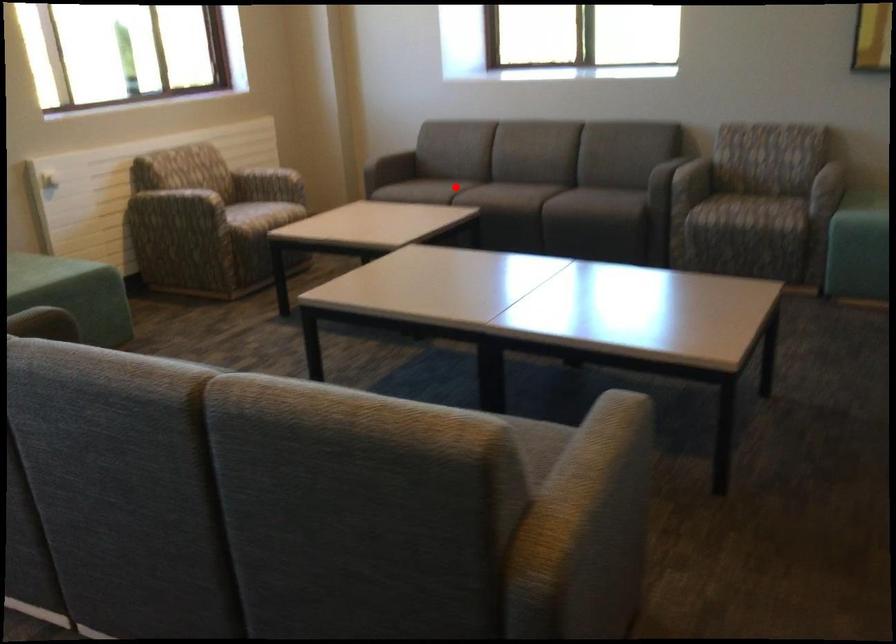
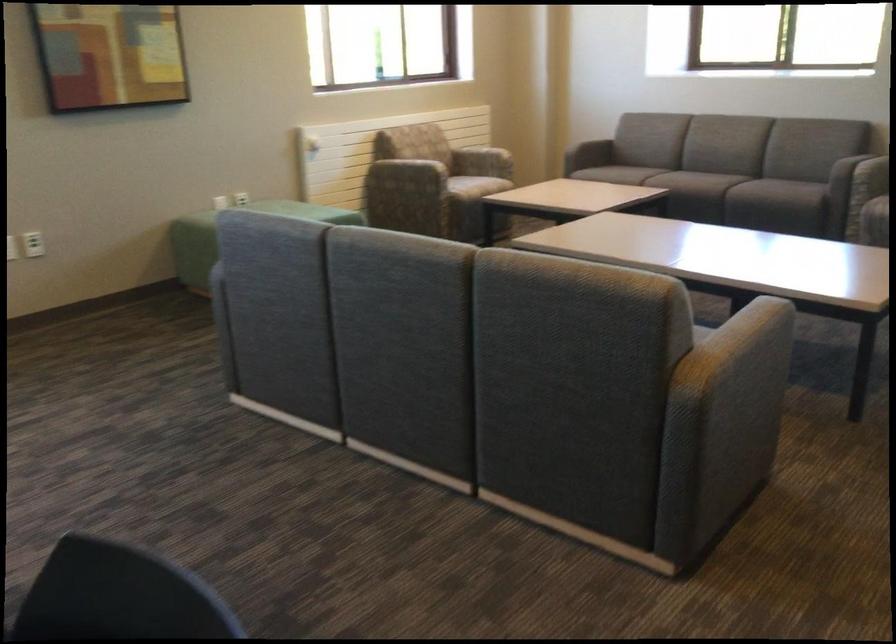
Question: I am providing you with two images of the same scene from different viewpoints. A red point is marked on the first image. Is the red point's position out of view in image 2?

Choices:
 (A) Yes
 (B) No

Answer: (A)